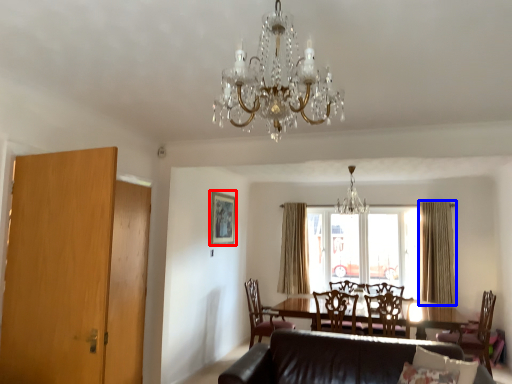
Question: Which point is closer to the camera, picture frame (highlighted by a red box) or curtain (highlighted by a blue box)?

Choices:
 (A) picture frame
 (B) curtain

Answer: (A)